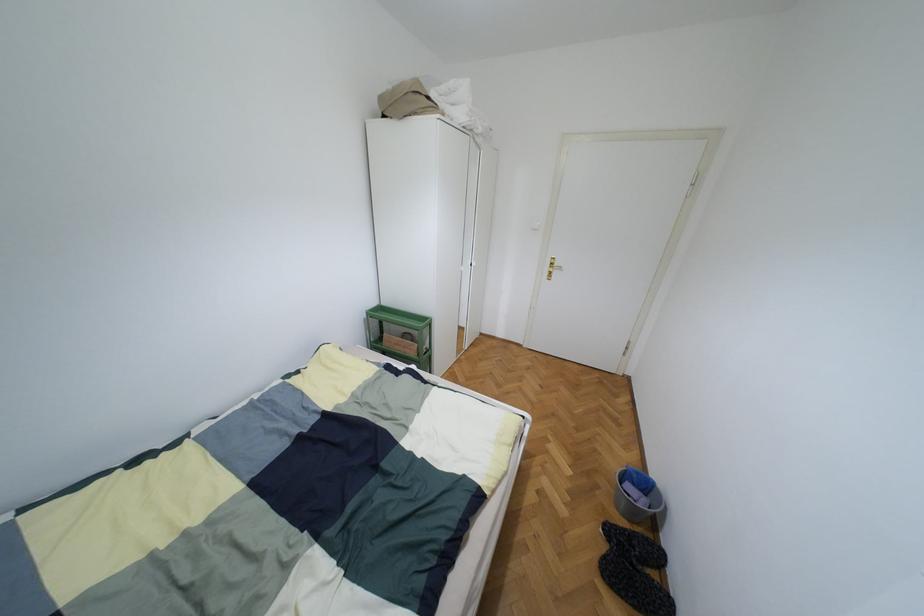
What do you see at coordinates (553, 265) in the screenshot?
I see `the gold door handle` at bounding box center [553, 265].